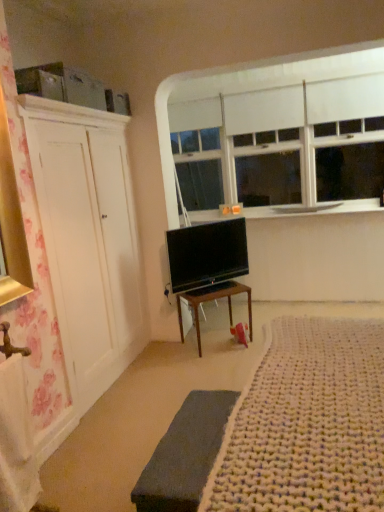
Where is `blank area beneath wooden desk at center (from a real-world perspective)`? blank area beneath wooden desk at center (from a real-world perspective) is located at coordinates (212, 342).